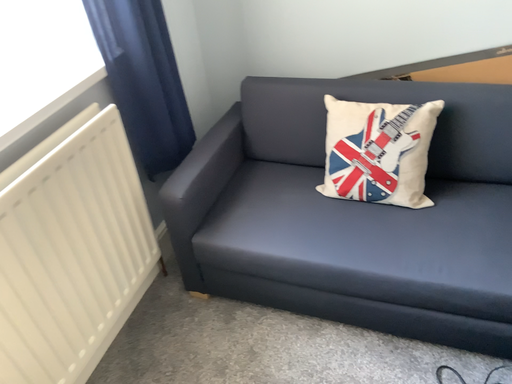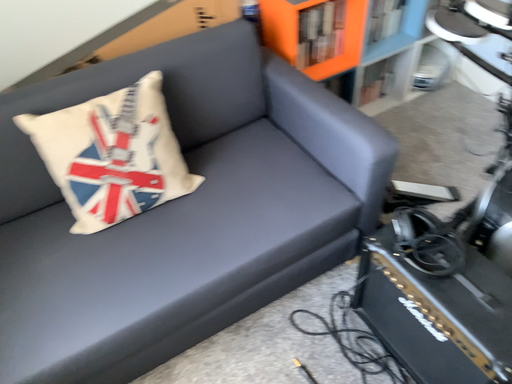
Question: Which way did the camera rotate in the video?

Choices:
 (A) rotated upward
 (B) rotated downward

Answer: (A)